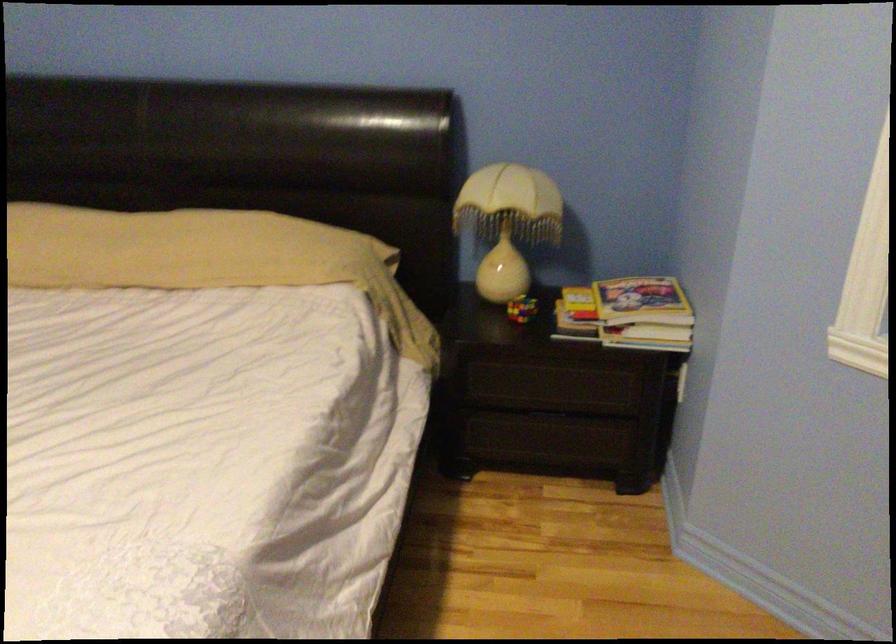
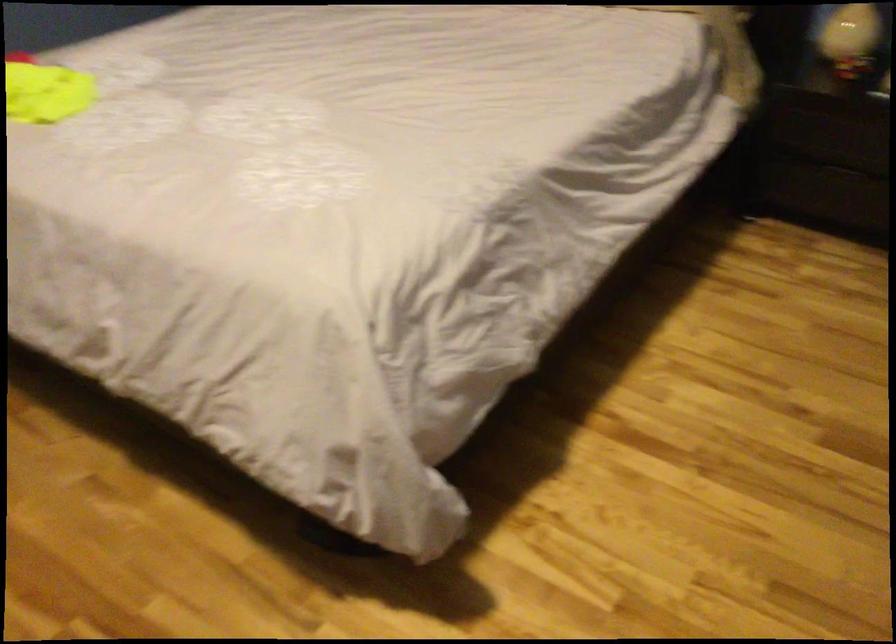
Find the pixel in the second image that matches point (513, 285) in the first image.

(851, 39)